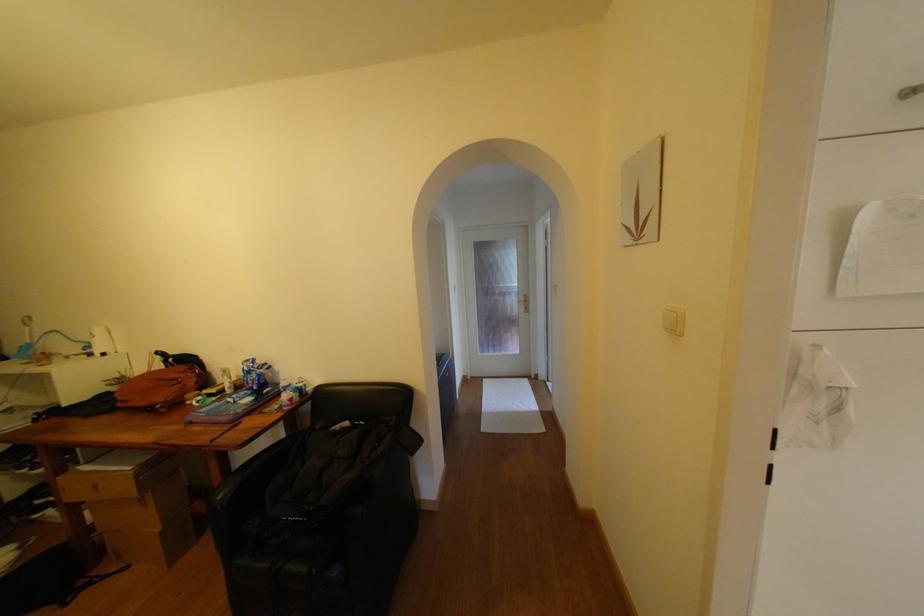
Identify the location of silver cabinet handle. (909, 91).